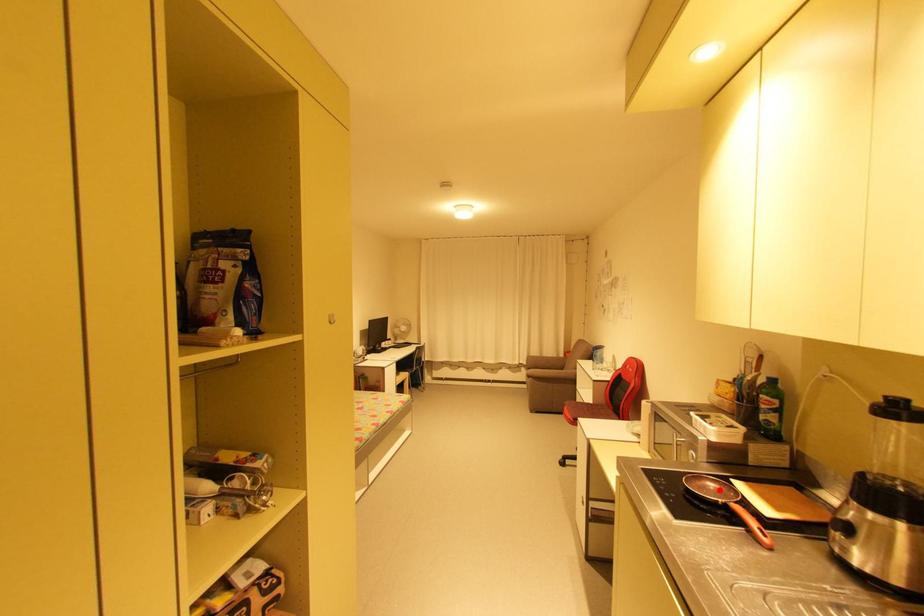
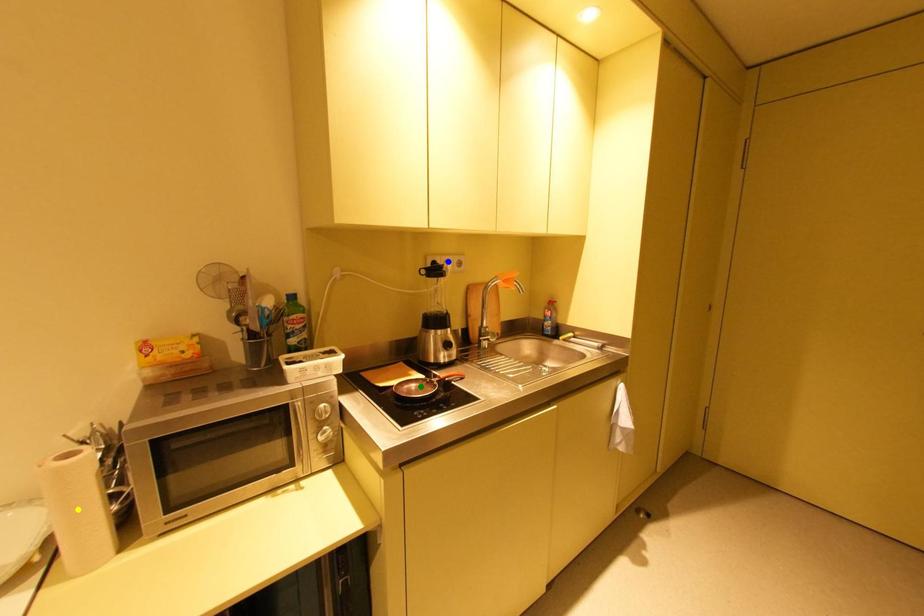
Question: I am providing you with two images of the same scene from different viewpoints. A red point is marked on the first image. You are given multiple points on the second image. Can you choose the point in image 2 that corresponds to the point in image 1?

Choices:
 (A) blue point
 (B) yellow point
 (C) green point

Answer: (C)